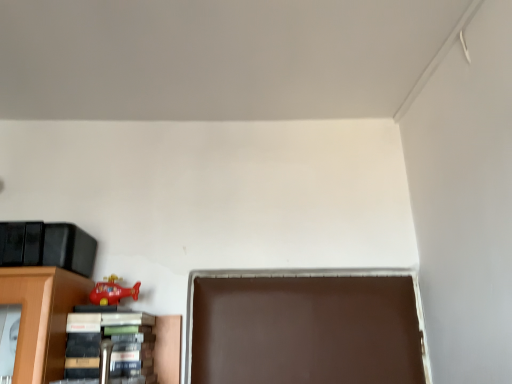
Locate an element on the screen. The image size is (512, 384). rubber red helicopter at lower left is located at coordinates (112, 292).

The width and height of the screenshot is (512, 384). What do you see at coordinates (112, 292) in the screenshot? I see `rubber red helicopter at lower left` at bounding box center [112, 292].

Image resolution: width=512 pixels, height=384 pixels. What do you see at coordinates (112, 346) in the screenshot? I see `hardcover book at lower left` at bounding box center [112, 346].

At what (x,y) coordinates should I click in order to perform the action: click on hardcover book at lower left. Please return your answer as a coordinate pair (x, y). Looking at the image, I should click on (112, 346).

Locate an element on the screen. The width and height of the screenshot is (512, 384). rubber red helicopter at lower left is located at coordinates (112, 292).

Does hardcover book at lower left appear on the left side of rubber red helicopter at lower left?

In fact, hardcover book at lower left is to the right of rubber red helicopter at lower left.

Is the position of hardcover book at lower left less distant than that of rubber red helicopter at lower left?

That is True.

Considering the points (81, 378) and (106, 295), which point is in front, point (81, 378) or point (106, 295)?

The point (81, 378) is closer.

From the image's perspective, would you say hardcover book at lower left is shown under rubber red helicopter at lower left?

Correct, hardcover book at lower left appears lower than rubber red helicopter at lower left in the image.

From a real-world perspective, relative to rubber red helicopter at lower left, is hardcover book at lower left vertically above or below?

Clearly, from a real-world perspective, hardcover book at lower left is below rubber red helicopter at lower left.

Which object is thinner, hardcover book at lower left or rubber red helicopter at lower left?

Thinner between the two is rubber red helicopter at lower left.

Which of these two, hardcover book at lower left or rubber red helicopter at lower left, stands taller?

Standing taller between the two is hardcover book at lower left.

Which of these two, hardcover book at lower left or rubber red helicopter at lower left, is smaller?

rubber red helicopter at lower left is smaller.

Would you say hardcover book at lower left is outside rubber red helicopter at lower left?

Yes, hardcover book at lower left is outside of rubber red helicopter at lower left.

Is hardcover book at lower left far from rubber red helicopter at lower left?

That's not correct — hardcover book at lower left is a little close to rubber red helicopter at lower left.

Looking at this image, could you tell me if hardcover book at lower left is turned towards rubber red helicopter at lower left?

No.

How different are the orientations of hardcover book at lower left and rubber red helicopter at lower left in degrees?

They differ by 5.99 degrees in their facing directions.

The image size is (512, 384). Find the location of `book lying below the rubber red helicopter at lower left (from the image's perspective)`. book lying below the rubber red helicopter at lower left (from the image's perspective) is located at coordinates (112, 346).

Between rubber red helicopter at lower left and hardcover book at lower left, which one appears on the right side from the viewer's perspective?

Positioned to the right is hardcover book at lower left.

Based on the photo, which object is further away from the camera taking this photo, rubber red helicopter at lower left or hardcover book at lower left?

rubber red helicopter at lower left is further from the camera.

Considering the positions of points (124, 297) and (62, 380), is point (124, 297) farther from camera compared to point (62, 380)?

Yes, point (124, 297) is behind point (62, 380).

From the image's perspective, does rubber red helicopter at lower left appear higher than hardcover book at lower left?

Indeed, from the image's perspective, rubber red helicopter at lower left is shown above hardcover book at lower left.

Consider the image. From a real-world perspective, is rubber red helicopter at lower left above or below hardcover book at lower left?

rubber red helicopter at lower left is above hardcover book at lower left.

Which object is thinner, rubber red helicopter at lower left or hardcover book at lower left?

rubber red helicopter at lower left.

Is rubber red helicopter at lower left taller or shorter than hardcover book at lower left?

In the image, rubber red helicopter at lower left appears to be shorter than hardcover book at lower left.

From the picture: Can you confirm if rubber red helicopter at lower left is bigger than hardcover book at lower left?

Actually, rubber red helicopter at lower left might be smaller than hardcover book at lower left.

Is rubber red helicopter at lower left located outside hardcover book at lower left?

rubber red helicopter at lower left lies outside hardcover book at lower left's area.

Are rubber red helicopter at lower left and hardcover book at lower left located far from each other?

No, rubber red helicopter at lower left is not far away from hardcover book at lower left.

In the scene shown: Is hardcover book at lower left at the back of rubber red helicopter at lower left?

rubber red helicopter at lower left does not have its back to hardcover book at lower left.

In the scene shown: Measure the distance between rubber red helicopter at lower left and hardcover book at lower left.

They are 5.66 inches apart.

Where is `book below the rubber red helicopter at lower left (from the image's perspective)`? book below the rubber red helicopter at lower left (from the image's perspective) is located at coordinates tap(112, 346).

Image resolution: width=512 pixels, height=384 pixels. Find the location of `toy to the left of hardcover book at lower left`. toy to the left of hardcover book at lower left is located at coordinates (112, 292).

At what (x,y) coordinates should I click in order to perform the action: click on toy located above the hardcover book at lower left (from a real-world perspective). Please return your answer as a coordinate pair (x, y). Looking at the image, I should click on (112, 292).